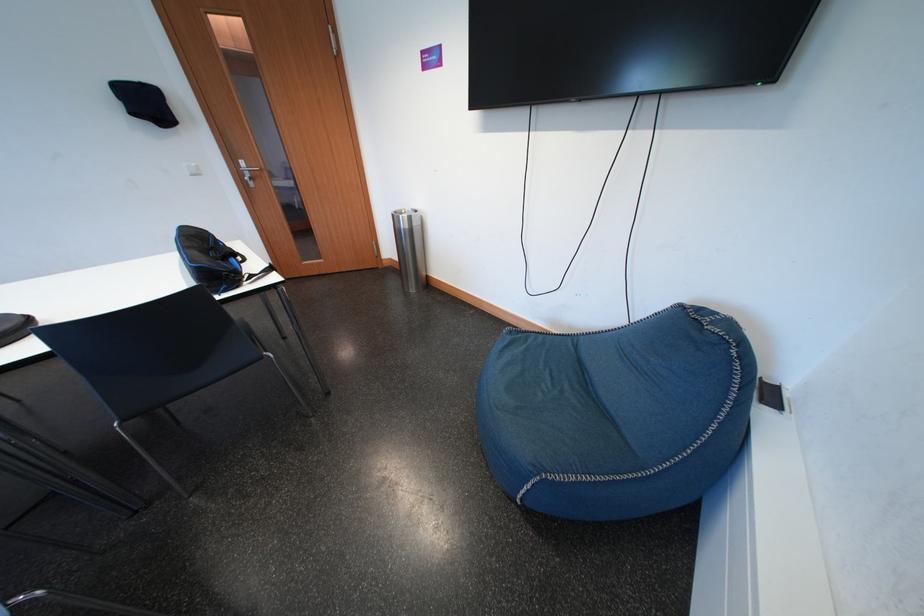
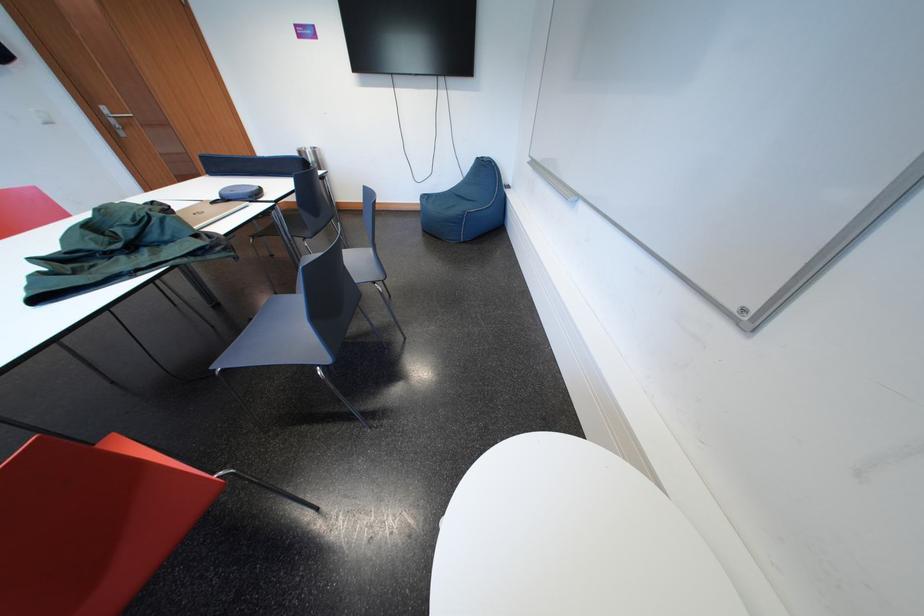
In the second image, find the point that corresponds to pixel 251 167 in the first image.

(113, 113)